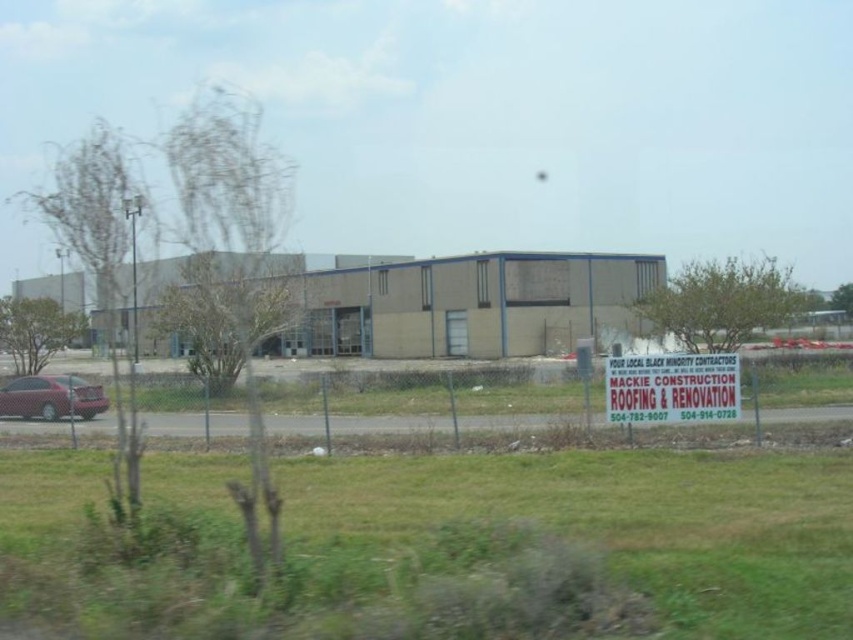
Question: Which point is farther to the camera?

Choices:
 (A) (67, 392)
 (B) (730, 406)

Answer: (A)

Question: In this image, where is white paper sign at center located relative to matte red car at left?

Choices:
 (A) left
 (B) right

Answer: (B)

Question: Does white paper sign at center appear on the right side of matte red car at left?

Choices:
 (A) yes
 (B) no

Answer: (A)

Question: Observing the image, what is the correct spatial positioning of white paper sign at center in reference to matte red car at left?

Choices:
 (A) below
 (B) above

Answer: (B)